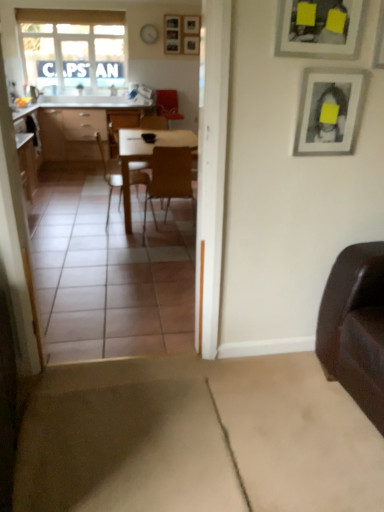
The width and height of the screenshot is (384, 512). I want to click on vacant space in front of wooden at center, which is the second chair in left-to-right order, so click(x=160, y=256).